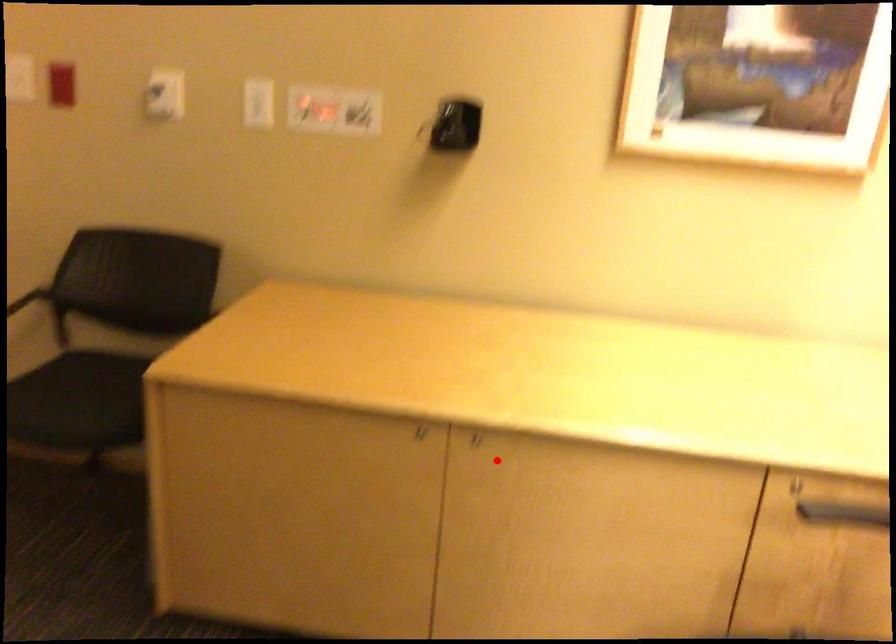
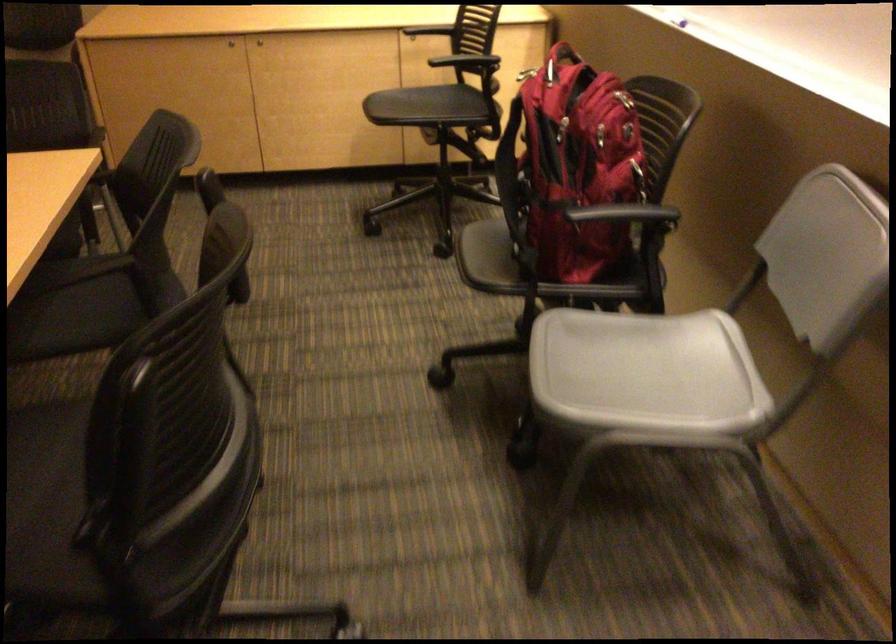
Question: I am providing you with two images of the same scene from different viewpoints. A red point is shown in image1. For the corresponding object point in image2, is it positioned nearer or farther from the camera?

Choices:
 (A) Nearer
 (B) Farther

Answer: (B)